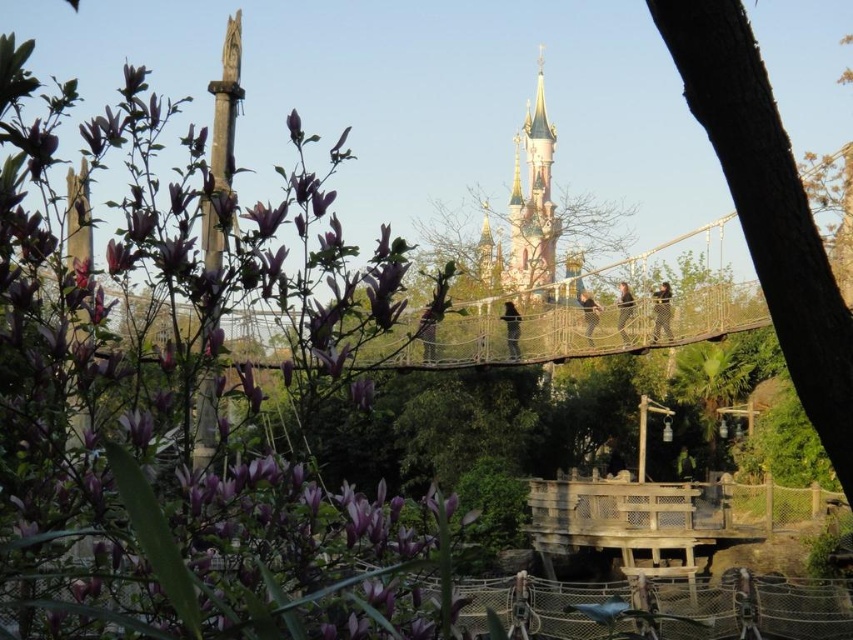
Who is shorter, brown rough bark tree at right or pastel pink castle at upper center?

Standing shorter between the two is brown rough bark tree at right.

Does point (744, 92) come farther from viewer compared to point (541, 145)?

That is False.

In order to click on brown rough bark tree at right in this screenshot , I will do coord(769,209).